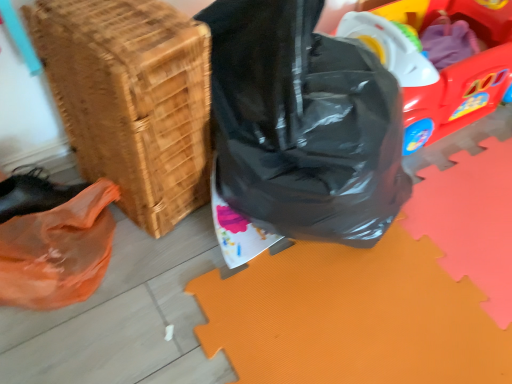
Question: Considering the relative sizes of black plastic bag at center and woven wood basket at lower left in the image provided, is black plastic bag at center shorter than woven wood basket at lower left?

Choices:
 (A) yes
 (B) no

Answer: (B)

Question: Is black plastic bag at center not within woven wood basket at lower left?

Choices:
 (A) no
 (B) yes

Answer: (B)

Question: Does black plastic bag at center have a greater height compared to woven wood basket at lower left?

Choices:
 (A) no
 (B) yes

Answer: (B)

Question: From the image's perspective, would you say black plastic bag at center is shown under woven wood basket at lower left?

Choices:
 (A) yes
 (B) no

Answer: (B)

Question: Is black plastic bag at center at the right side of woven wood basket at lower left?

Choices:
 (A) no
 (B) yes

Answer: (B)

Question: In terms of size, does black plastic bag at center appear bigger or smaller than rubberized plastic wagon at upper right?

Choices:
 (A) big
 (B) small

Answer: (A)

Question: From the image's perspective, is black plastic bag at center above or below rubberized plastic wagon at upper right?

Choices:
 (A) above
 (B) below

Answer: (B)

Question: In terms of height, does black plastic bag at center look taller or shorter compared to rubberized plastic wagon at upper right?

Choices:
 (A) short
 (B) tall

Answer: (B)

Question: Is black plastic bag at center wider or thinner than rubberized plastic wagon at upper right?

Choices:
 (A) wide
 (B) thin

Answer: (B)

Question: From their relative heights in the image, would you say black plastic bag at center is taller or shorter than woven wood basket at lower left?

Choices:
 (A) short
 (B) tall

Answer: (B)

Question: Considering the positions of black plastic bag at center and woven wood basket at lower left in the image, is black plastic bag at center bigger or smaller than woven wood basket at lower left?

Choices:
 (A) big
 (B) small

Answer: (A)

Question: Looking at their shapes, would you say black plastic bag at center is wider or thinner than woven wood basket at lower left?

Choices:
 (A) wide
 (B) thin

Answer: (A)

Question: Is black plastic bag at center in front of or behind woven wood basket at lower left in the image?

Choices:
 (A) behind
 (B) front

Answer: (B)

Question: Is woven wood basket at lower left inside or outside of black plastic bag at center?

Choices:
 (A) inside
 (B) outside

Answer: (B)

Question: Considering the positions of woven wood basket at lower left and black plastic bag at center in the image, is woven wood basket at lower left bigger or smaller than black plastic bag at center?

Choices:
 (A) small
 (B) big

Answer: (A)